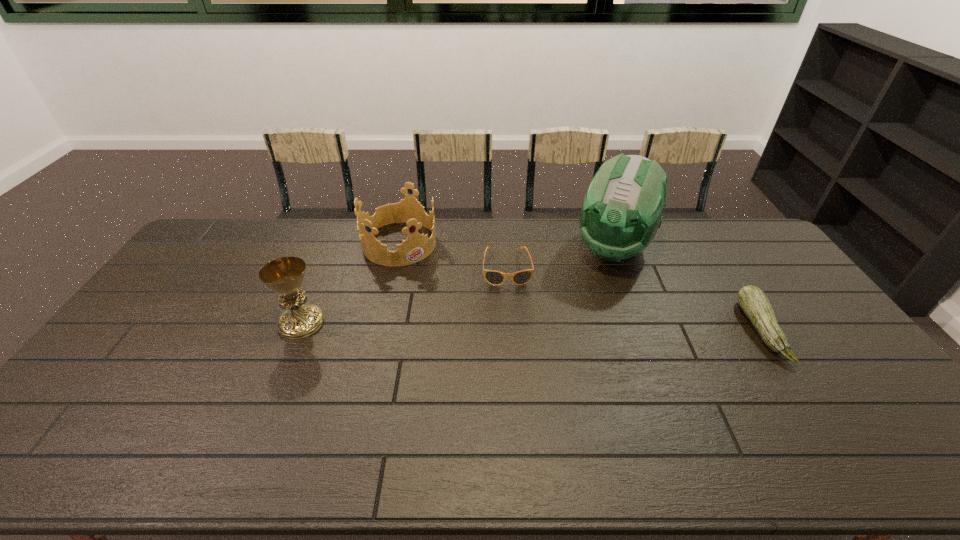
What are the coordinates of `free space between the third object from left to right and the second shortest object` in the screenshot? It's located at (634, 299).

Where is `vacant space that's between the second shortest object and the fourth object from left to right`? vacant space that's between the second shortest object and the fourth object from left to right is located at coordinates (687, 289).

Where is `vacant point located between the zucchini and the leftmost object`? vacant point located between the zucchini and the leftmost object is located at coordinates (531, 326).

Find the location of a particular element. free area in between the fourth object from left to right and the chalice is located at coordinates (457, 286).

Find the location of a particular element. Image resolution: width=960 pixels, height=540 pixels. free space that is in between the sunglasses and the chalice is located at coordinates [x=404, y=295].

Locate an element on the screen. The width and height of the screenshot is (960, 540). free spot between the third object from right to left and the tallest object is located at coordinates (560, 258).

Identify which object is located as the fourth nearest to the zucchini. Please provide its 2D coordinates. Your answer should be formatted as a tuple, i.e. [(x, y)], where the tuple contains the x and y coordinates of a point satisfying the conditions above.

[(285, 275)]

Where is `the closest object relative to the fourth object from left to right`? the closest object relative to the fourth object from left to right is located at coordinates (493, 277).

Identify the location of free space that satisfies the following two spatial constraints: 1. on the front side of the tiara; 2. at the stem end of the second shortest object. (380, 330).